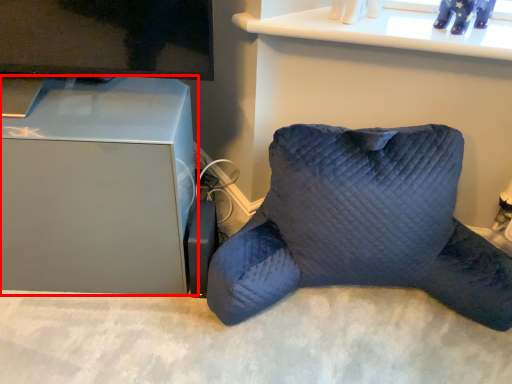
Question: Where is furniture (annotated by the red box) located in relation to pillow in the image?

Choices:
 (A) left
 (B) right

Answer: (A)